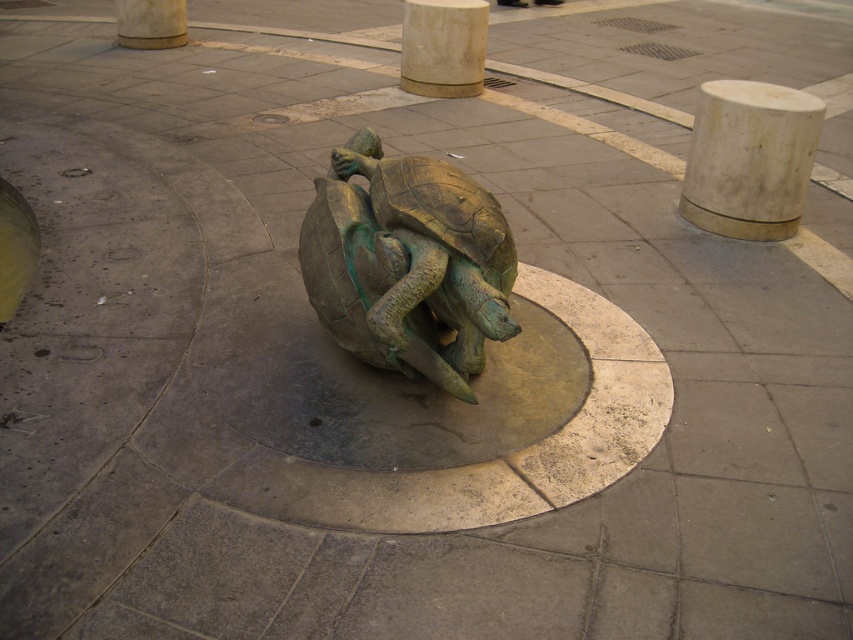
Where is `green patina turtle at center`? The height and width of the screenshot is (640, 853). green patina turtle at center is located at coordinates (408, 262).

This screenshot has width=853, height=640. Identify the location of green patina turtle at center. (408, 262).

Between green patina turtle at center and white marble pillar at center, which one has more height?

Standing taller between the two is green patina turtle at center.

Between green patina turtle at center and white marble pillar at center, which one appears on the left side from the viewer's perspective?

From the viewer's perspective, green patina turtle at center appears more on the left side.

Who is more forward, (316, 186) or (448, 40)?

Point (316, 186) is in front.

Image resolution: width=853 pixels, height=640 pixels. I want to click on green patina turtle at center, so click(x=408, y=262).

The height and width of the screenshot is (640, 853). I want to click on white marble pillar at upper right, so click(749, 157).

Does white marble pillar at upper right appear over white marble pillar at center?

No.

I want to click on white marble pillar at upper right, so click(749, 157).

I want to click on white marble pillar at upper right, so click(x=749, y=157).